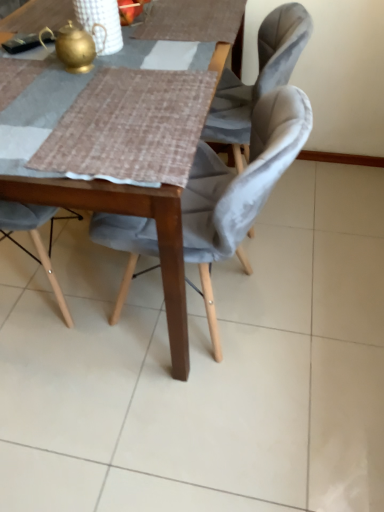
The image size is (384, 512). I want to click on vacant space in front of gold metallic teapot at upper left, so [71, 98].